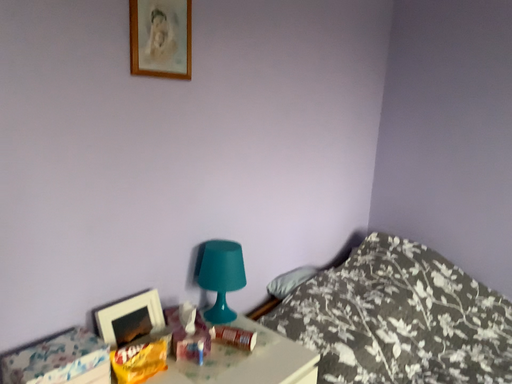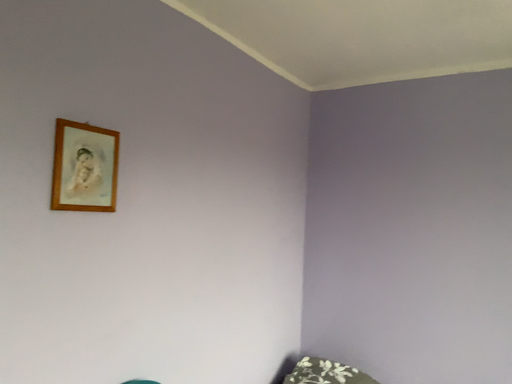
Question: Which way did the camera rotate in the video?

Choices:
 (A) rotated left
 (B) rotated right

Answer: (B)